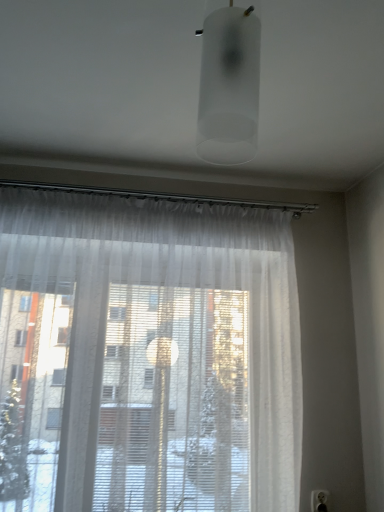
Question: Does sheer white curtain at center have a greater width compared to frosted glass cylinder at upper center?

Choices:
 (A) no
 (B) yes

Answer: (B)

Question: From the image's perspective, is sheer white curtain at center under frosted glass cylinder at upper center?

Choices:
 (A) yes
 (B) no

Answer: (A)

Question: Is sheer white curtain at center bigger than frosted glass cylinder at upper center?

Choices:
 (A) no
 (B) yes

Answer: (B)

Question: Is sheer white curtain at center turned away from frosted glass cylinder at upper center?

Choices:
 (A) yes
 (B) no

Answer: (B)

Question: Is sheer white curtain at center oriented towards frosted glass cylinder at upper center?

Choices:
 (A) yes
 (B) no

Answer: (A)

Question: From the image's perspective, is frosted glass cylinder at upper center above or below white plastic electric outlet at lower right?

Choices:
 (A) above
 (B) below

Answer: (A)

Question: Would you say frosted glass cylinder at upper center is to the left or to the right of white plastic electric outlet at lower right in the picture?

Choices:
 (A) right
 (B) left

Answer: (B)

Question: Considering the positions of frosted glass cylinder at upper center and white plastic electric outlet at lower right in the image, is frosted glass cylinder at upper center wider or thinner than white plastic electric outlet at lower right?

Choices:
 (A) thin
 (B) wide

Answer: (B)

Question: Is frosted glass cylinder at upper center bigger or smaller than white plastic electric outlet at lower right?

Choices:
 (A) big
 (B) small

Answer: (A)

Question: Is sheer white curtain at center to the left or to the right of frosted glass cylinder at upper center in the image?

Choices:
 (A) right
 (B) left

Answer: (B)

Question: In terms of width, does sheer white curtain at center look wider or thinner when compared to frosted glass cylinder at upper center?

Choices:
 (A) thin
 (B) wide

Answer: (B)

Question: From a real-world perspective, is sheer white curtain at center positioned above or below frosted glass cylinder at upper center?

Choices:
 (A) below
 (B) above

Answer: (A)

Question: From the image's perspective, is sheer white curtain at center above or below frosted glass cylinder at upper center?

Choices:
 (A) above
 (B) below

Answer: (B)

Question: Looking at the image, does frosted glass cylinder at upper center seem bigger or smaller compared to sheer white curtain at center?

Choices:
 (A) big
 (B) small

Answer: (B)

Question: Considering the positions of frosted glass cylinder at upper center and sheer white curtain at center in the image, is frosted glass cylinder at upper center wider or thinner than sheer white curtain at center?

Choices:
 (A) wide
 (B) thin

Answer: (B)